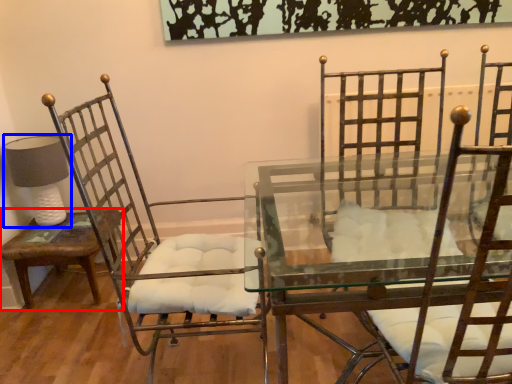
Question: Among these objects, which one is nearest to the camera, table (highlighted by a red box) or table lamp (highlighted by a blue box)?

Choices:
 (A) table
 (B) table lamp

Answer: (A)